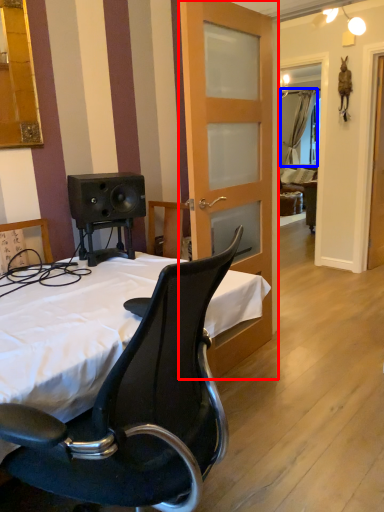
Question: Among these objects, which one is nearest to the camera, door (highlighted by a red box) or curtain (highlighted by a blue box)?

Choices:
 (A) door
 (B) curtain

Answer: (A)